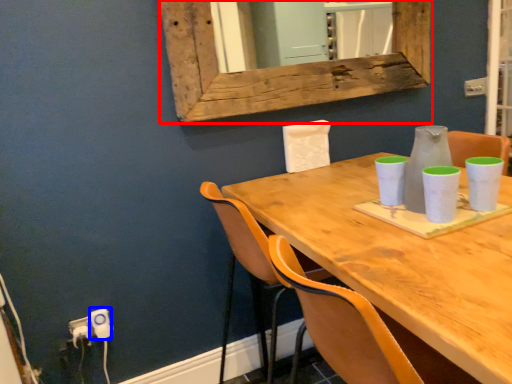
Question: Which of the following is the farthest to the observer, window frame (highlighted by a red box) or electric outlet (highlighted by a blue box)?

Choices:
 (A) window frame
 (B) electric outlet

Answer: (B)